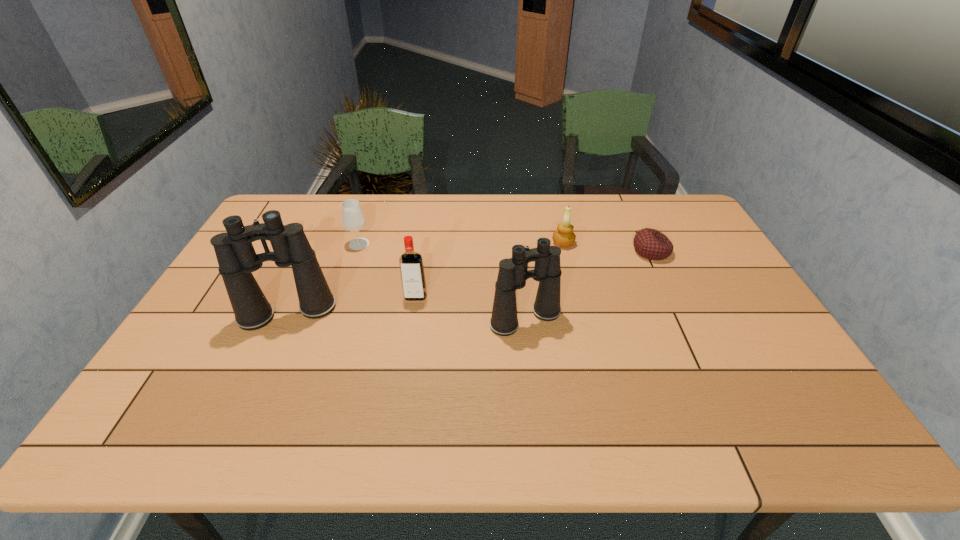
Observe the arrangement of all binocularss in the image. To keep them evenly spaced, where would you place another binoculars on the right? Please locate a free space. Please provide its 2D coordinates. Your answer should be formatted as a tuple, i.e. [(x, y)], where the tuple contains the x and y coordinates of a point satisfying the conditions above.

[(770, 325)]